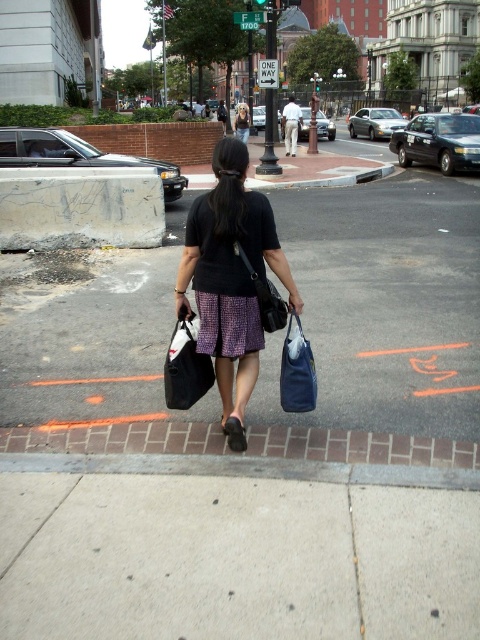
You are a delivery person on a bike and need to choose a path to avoid potholes. You see the smooth asphalt road at center and the concrete at center. Which path should you choose?

The smooth asphalt road at center is in front of concrete at center, so you should choose the smooth asphalt road at center to avoid potholes since it is more likely to be in better condition.

You are a delivery person who needs to place a package on the gray concrete sidewalk at lower center. However, there is a matte blue fabric bag at lower center in the way. Can you place the package on the sidewalk without moving the bag?

The gray concrete sidewalk at lower center is below the matte blue fabric bag at lower center, meaning the bag is positioned above the sidewalk. Since the bag is above, you can place the package on the sidewalk underneath it without moving the bag.

You are a delivery person trying to determine which item is shorter between the matte black bag at center and the matte black skirt at center. Based on the scene, which one is shorter?

The matte black bag at center is shorter than the matte black skirt at center according to the description.